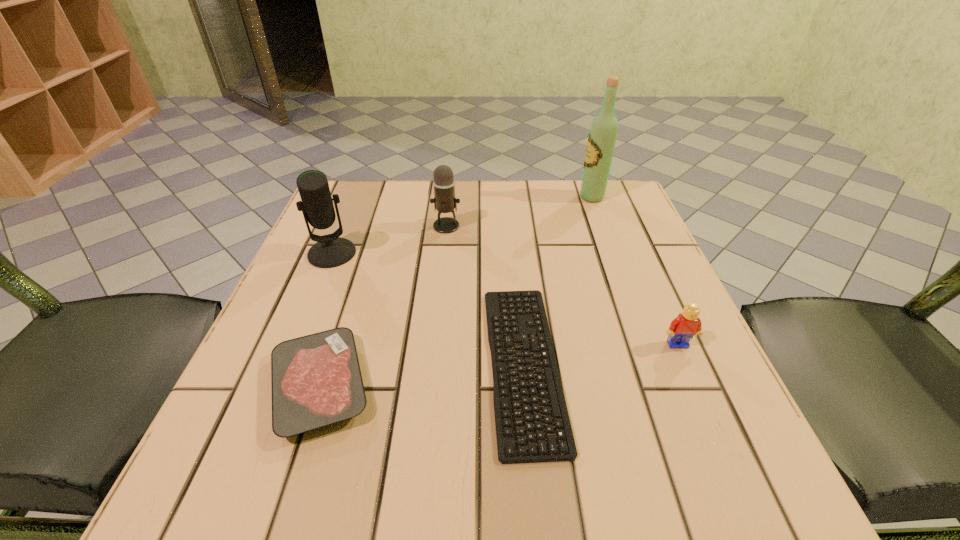
Locate an element on the screen. This screenshot has height=540, width=960. free space between the steak and the fourth object from left to right is located at coordinates (421, 375).

Locate an element on the screen. Image resolution: width=960 pixels, height=540 pixels. free space between the steak and the nearer microphone is located at coordinates (326, 320).

Locate an element on the screen. Image resolution: width=960 pixels, height=540 pixels. vacant region between the third tallest object and the second shortest object is located at coordinates (383, 306).

The width and height of the screenshot is (960, 540). In order to click on free space between the fifth tallest object and the third object from right to left in this screenshot , I will do `click(421, 375)`.

Choose which object is the nearest neighbor to the tallest object. Please provide its 2D coordinates. Your answer should be formatted as a tuple, i.e. [(x, y)], where the tuple contains the x and y coordinates of a point satisfying the conditions above.

[(444, 200)]

Identify the location of object that stands as the closest to the second shortest object. (506, 445).

Where is `free spot that satisfies the following two spatial constraints: 1. on the front-facing side of the tallest object; 2. on the front side of the taller microphone`? The image size is (960, 540). free spot that satisfies the following two spatial constraints: 1. on the front-facing side of the tallest object; 2. on the front side of the taller microphone is located at coordinates (612, 253).